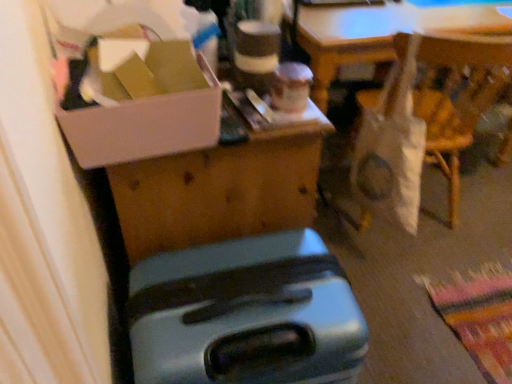
Describe the element at coordinates (425, 119) in the screenshot. I see `white fabric bag at right` at that location.

Image resolution: width=512 pixels, height=384 pixels. What do you see at coordinates (142, 125) in the screenshot?
I see `white cardboard box at upper left` at bounding box center [142, 125].

At what (x,y) coordinates should I click in order to perform the action: click on metallic suitcase at lower center. Please return your answer as a coordinate pair (x, y). The height and width of the screenshot is (384, 512). Looking at the image, I should click on (246, 314).

From the picture: From a real-world perspective, is white cardboard box at upper left beneath metallic suitcase at lower center?

No, from a real-world perspective, white cardboard box at upper left is not below metallic suitcase at lower center.

Between white cardboard box at upper left and metallic suitcase at lower center, which one has smaller size?

white cardboard box at upper left.

What's the angular difference between white cardboard box at upper left and metallic suitcase at lower center's facing directions?

0.0253 degrees separate the facing orientations of white cardboard box at upper left and metallic suitcase at lower center.

Is white cardboard box at upper left positioned beyond the bounds of metallic suitcase at lower center?

That's correct, white cardboard box at upper left is outside of metallic suitcase at lower center.

Which is more to the right, white cardboard box at upper left or white fabric bag at right?

From the viewer's perspective, white fabric bag at right appears more on the right side.

From a real-world perspective, does white cardboard box at upper left sit lower than white fabric bag at right?

No.

Is the depth of white cardboard box at upper left less than that of white fabric bag at right?

Yes, it is in front of white fabric bag at right.

Measure the distance between white cardboard box at upper left and white fabric bag at right.

They are 1.07 meters apart.

Could you tell me if white fabric bag at right is turned towards metallic suitcase at lower center?

Yes.

Is white fabric bag at right wider or thinner than metallic suitcase at lower center?

Considering their sizes, white fabric bag at right looks slimmer than metallic suitcase at lower center.

From a real-world perspective, is white fabric bag at right located higher than metallic suitcase at lower center?

Yes.

From a real-world perspective, is white fabric bag at right physically located above or below white cardboard box at upper left?

In terms of real-world spatial position, white fabric bag at right is below white cardboard box at upper left.

Considering the relative sizes of white fabric bag at right and white cardboard box at upper left in the image provided, is white fabric bag at right bigger than white cardboard box at upper left?

Yes, white fabric bag at right is bigger than white cardboard box at upper left.

Considering the relative positions of white fabric bag at right and white cardboard box at upper left in the image provided, is white fabric bag at right to the right of white cardboard box at upper left from the viewer's perspective?

Yes, white fabric bag at right is to the right of white cardboard box at upper left.

Does point (458, 198) appear closer or farther from the camera than point (140, 132)?

Point (458, 198) is farther from the camera than point (140, 132).

From the image's perspective, which is above, metallic suitcase at lower center or white fabric bag at right?

white fabric bag at right appears higher in the image.

Is white fabric bag at right completely or partially inside metallic suitcase at lower center?

No, white fabric bag at right is not a part of metallic suitcase at lower center.

In the scene shown: Considering the positions of objects metallic suitcase at lower center and white fabric bag at right in the image provided, who is more to the right, metallic suitcase at lower center or white fabric bag at right?

From the viewer's perspective, white fabric bag at right appears more on the right side.

Is metallic suitcase at lower center oriented away from white cardboard box at upper left?

No.

Is metallic suitcase at lower center in contact with white cardboard box at upper left?

metallic suitcase at lower center and white cardboard box at upper left are clearly separated.

Considering the sizes of objects metallic suitcase at lower center and white cardboard box at upper left in the image provided, who is wider, metallic suitcase at lower center or white cardboard box at upper left?

metallic suitcase at lower center.

From the picture: How far apart are metallic suitcase at lower center and white cardboard box at upper left?

12.18 inches.

Locate an element on the screen. The image size is (512, 384). box behind the metallic suitcase at lower center is located at coordinates (142, 125).

This screenshot has width=512, height=384. I want to click on box above the white fabric bag at right (from a real-world perspective), so click(x=142, y=125).

From the image, which object appears to be farther from white cardboard box at upper left, metallic suitcase at lower center or white fabric bag at right?

white fabric bag at right.

Considering their positions, is white fabric bag at right positioned further to metallic suitcase at lower center than white cardboard box at upper left?

white fabric bag at right lies further to metallic suitcase at lower center than the other object.

Estimate the real-world distances between objects in this image. Which object is further from metallic suitcase at lower center, white cardboard box at upper left or white fabric bag at right?

Based on the image, white fabric bag at right appears to be further to metallic suitcase at lower center.

Which object lies further to the anchor point white fabric bag at right, metallic suitcase at lower center or white cardboard box at upper left?

The object further to white fabric bag at right is white cardboard box at upper left.

Looking at the image, which one is located further to white cardboard box at upper left, white fabric bag at right or metallic suitcase at lower center?

Based on the image, white fabric bag at right appears to be further to white cardboard box at upper left.

When comparing their distances from white fabric bag at right, does white cardboard box at upper left or metallic suitcase at lower center seem closer?

Among the two, metallic suitcase at lower center is located nearer to white fabric bag at right.

Image resolution: width=512 pixels, height=384 pixels. Find the location of `luggage between white cardboard box at upper left and white fabric bag at right`. luggage between white cardboard box at upper left and white fabric bag at right is located at coordinates (246, 314).